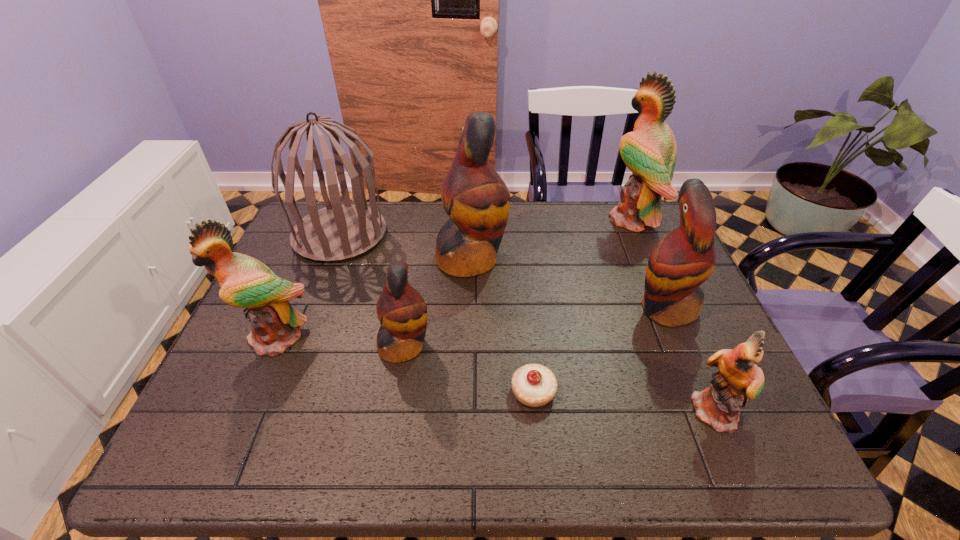
The width and height of the screenshot is (960, 540). In order to click on object at the far right corner in this screenshot , I will do `click(649, 152)`.

Find the location of a particular element. The width and height of the screenshot is (960, 540). object that is at the near right corner is located at coordinates (739, 378).

Where is `vacant space at the far edge`? vacant space at the far edge is located at coordinates (580, 207).

Identify the location of free space at the near edge of the desktop. (286, 431).

Locate an element on the screen. free location at the left edge of the desktop is located at coordinates (233, 343).

I want to click on vacant space at the right edge of the desktop, so click(644, 249).

This screenshot has width=960, height=540. I want to click on free space between the fifth nearest parrot and the beige pastry, so click(502, 325).

The width and height of the screenshot is (960, 540). I want to click on free space between the biggest green parrot and the beige pastry, so click(583, 306).

Find the location of a particular element. free space between the smallest red parrot and the beige pastry is located at coordinates (468, 369).

This screenshot has height=540, width=960. What are the coordinates of `vacant area that lies between the second nearest green parrot and the beige pastry` in the screenshot? It's located at (405, 364).